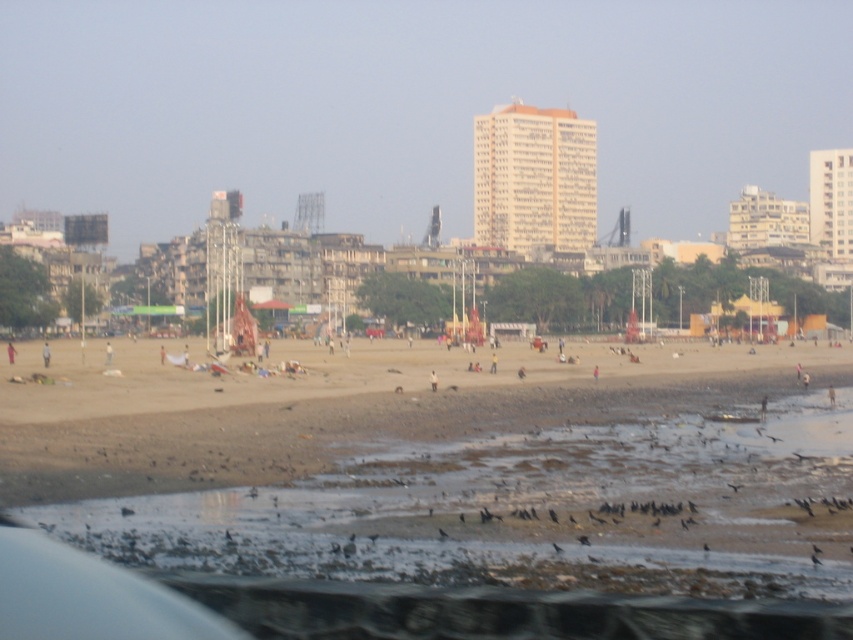
Question: Is brown mudflat at lower center in front of brown sand at lower center?

Choices:
 (A) yes
 (B) no

Answer: (A)

Question: Can you confirm if brown mudflat at lower center is positioned below brown sand at lower center?

Choices:
 (A) yes
 (B) no

Answer: (A)

Question: Which of the following is the farthest from the observer?

Choices:
 (A) (633, 520)
 (B) (115, 449)

Answer: (B)

Question: Is brown mudflat at lower center thinner than brown sand at lower center?

Choices:
 (A) no
 (B) yes

Answer: (B)

Question: Which point appears farthest from the camera in this image?

Choices:
 (A) (660, 364)
 (B) (676, 448)

Answer: (A)